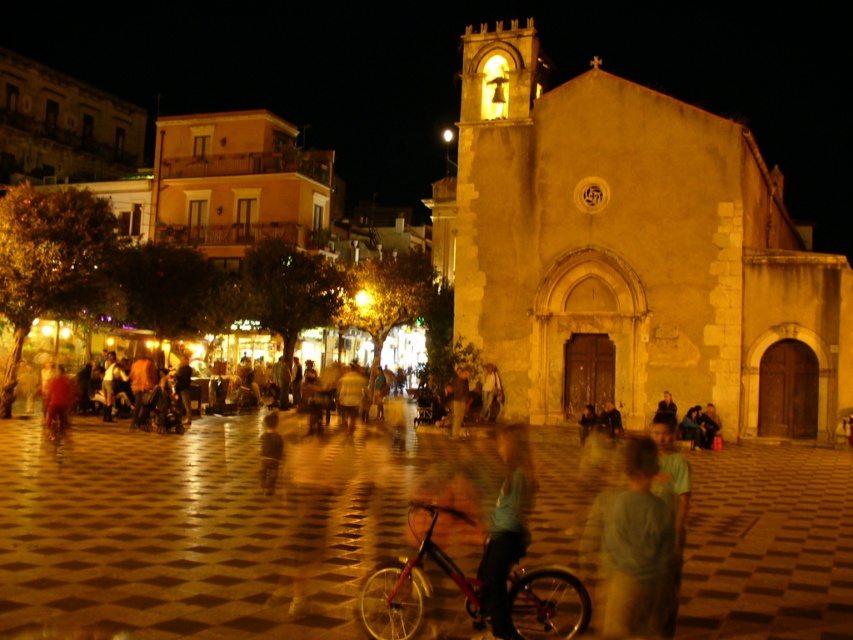
You are a photographer standing in the town square and want to capture both the light blue cotton shirt at center and the shiny red bicycle at center in a single photo. Which object should you focus on first to ensure both are in frame?

The light blue cotton shirt at center is larger in size compared to the shiny red bicycle at center, so you should focus on the light blue cotton shirt at center first to ensure both are in frame.

You are standing at point (260, 461) and want to walk to the historic stone church with a prominent bell tower. Is the point (457, 621) between you and the church?

Yes, point (457, 621) is between you at point (260, 461) and the historic stone church with a prominent bell tower because the description states that point (457, 621) is in front of point (260, 461).